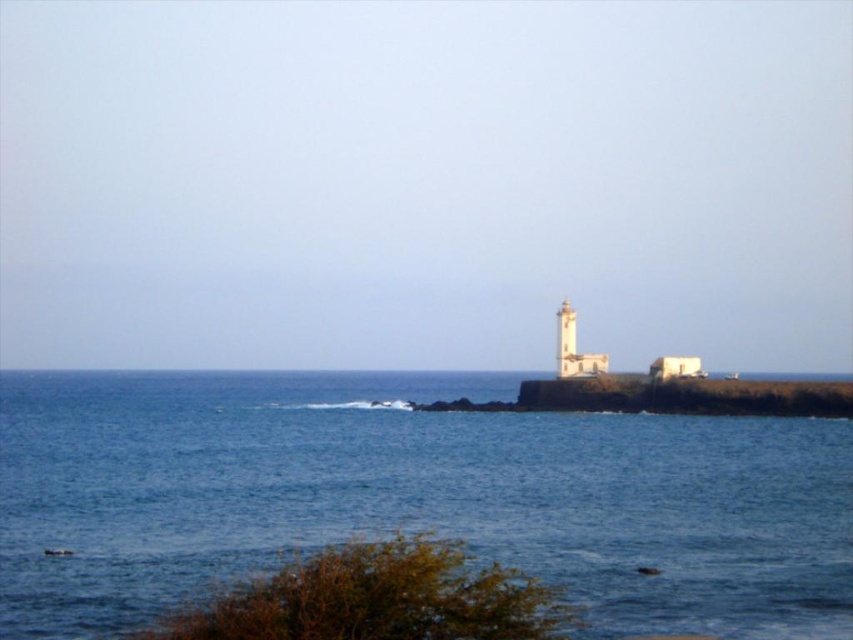
Question: Does blue water at center lie behind white painted concrete tower at center?

Choices:
 (A) yes
 (B) no

Answer: (B)

Question: Is blue water at center above white painted concrete tower at center?

Choices:
 (A) no
 (B) yes

Answer: (A)

Question: Is white stucco lighthouse at center bigger than white painted concrete tower at center?

Choices:
 (A) no
 (B) yes

Answer: (B)

Question: Among these points, which one is nearest to the camera?

Choices:
 (A) (543, 572)
 (B) (570, 317)

Answer: (A)

Question: Which point is closer to the camera taking this photo?

Choices:
 (A) (563, 333)
 (B) (563, 323)

Answer: (A)

Question: Among these objects, which one is farthest from the camera?

Choices:
 (A) white painted concrete tower at center
 (B) white stucco lighthouse at center
 (C) blue water at center

Answer: (A)